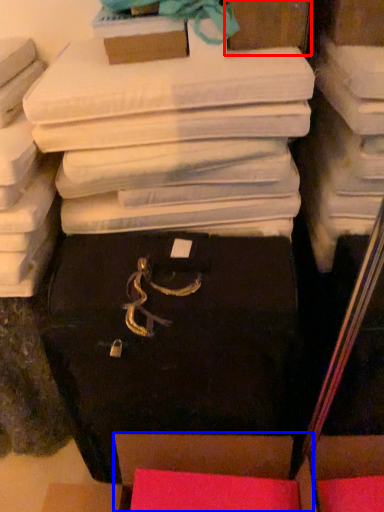
Question: Which object is closer to the camera taking this photo, storage box (highlighted by a red box) or storage box (highlighted by a blue box)?

Choices:
 (A) storage box
 (B) storage box

Answer: (B)